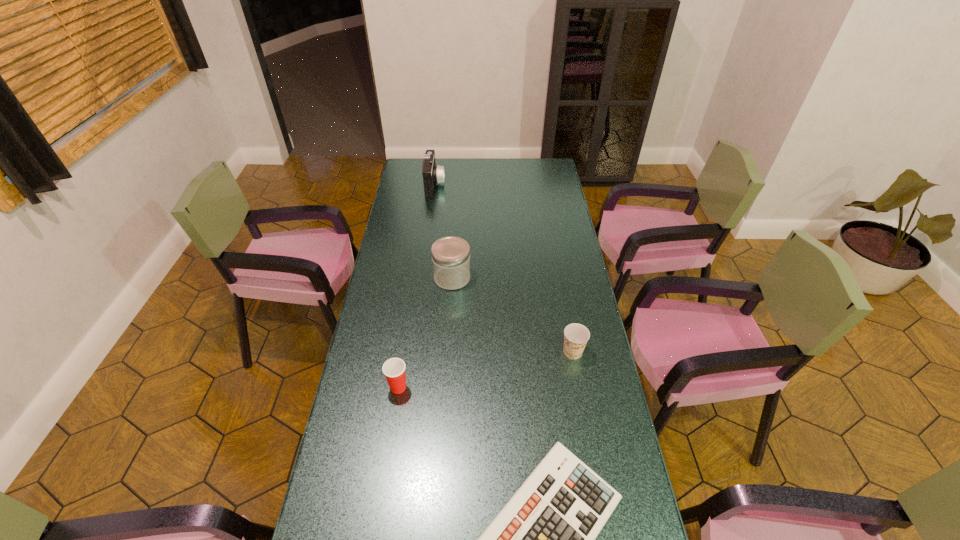
Identify the location of jar. The width and height of the screenshot is (960, 540). (450, 255).

The width and height of the screenshot is (960, 540). What are the coordinates of `the farthest object` in the screenshot? It's located at (433, 174).

Find the location of `the left Dixie cup`. the left Dixie cup is located at coordinates (394, 369).

This screenshot has width=960, height=540. Identify the location of the fourth farthest object. (394, 369).

The image size is (960, 540). I want to click on the third farthest object, so click(576, 335).

Identify the location of the farther Dixie cup. tap(576, 335).

Find the location of a particular element. The width and height of the screenshot is (960, 540). free region located on the back of the jar is located at coordinates pyautogui.click(x=454, y=248).

The image size is (960, 540). What are the coordinates of `vacant region located 0.190m on the lens of the camcorder` in the screenshot? It's located at click(x=481, y=184).

Locate an element on the screen. This screenshot has height=540, width=960. free space located on the front of the nearer Dixie cup is located at coordinates (391, 439).

Where is `free region located on the front of the third farthest object`? The height and width of the screenshot is (540, 960). free region located on the front of the third farthest object is located at coordinates (595, 472).